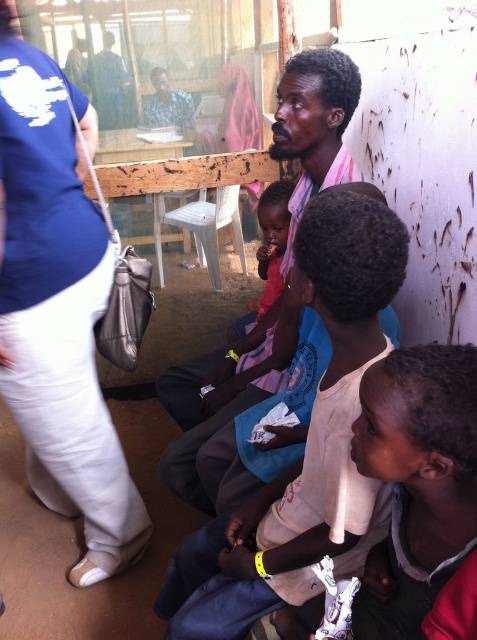
Can you confirm if blue fabric shirt at left is shorter than pink fabric at center?

In fact, blue fabric shirt at left may be taller than pink fabric at center.

Locate an element on the screen. Image resolution: width=477 pixels, height=640 pixels. blue fabric shirt at left is located at coordinates (58, 314).

Identify the location of blue fabric shirt at left. Image resolution: width=477 pixels, height=640 pixels. (58, 314).

The image size is (477, 640). In order to click on blue fabric shirt at left in this screenshot , I will do `click(58, 314)`.

Can you confirm if light brown cotton shirt at center is positioned to the left of pink fabric at center?

Incorrect, light brown cotton shirt at center is not on the left side of pink fabric at center.

This screenshot has height=640, width=477. What do you see at coordinates (306, 436) in the screenshot? I see `light brown cotton shirt at center` at bounding box center [306, 436].

I want to click on light brown cotton shirt at center, so click(x=306, y=436).

Who is lower down, blue fabric shirt at left or light brown cotton shirt at center?

light brown cotton shirt at center

Identify the location of blue fabric shirt at left. This screenshot has width=477, height=640. (58, 314).